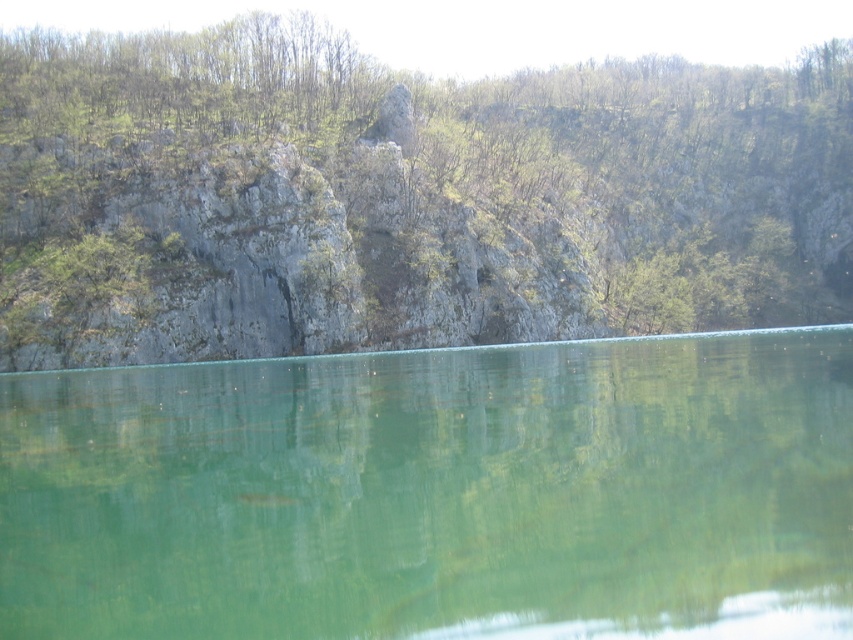
Question: Where is green leafy tree at upper center located in relation to green glassy water at center in the image?

Choices:
 (A) above
 (B) below

Answer: (A)

Question: Which point is closer to the camera?

Choices:
 (A) green leafy trees at upper center
 (B) green leafy tree at upper center

Answer: (B)

Question: Is green glassy water at center above green leafy trees at upper center?

Choices:
 (A) no
 (B) yes

Answer: (A)

Question: Which point appears closest to the camera in this image?

Choices:
 (A) (437, 188)
 (B) (303, 96)
 (C) (344, 417)

Answer: (C)

Question: Which of the following is the farthest from the observer?

Choices:
 (A) green leafy tree at upper center
 (B) green glassy water at center

Answer: (A)

Question: Can you confirm if green leafy tree at upper center is positioned to the left of green leafy trees at upper center?

Choices:
 (A) no
 (B) yes

Answer: (A)